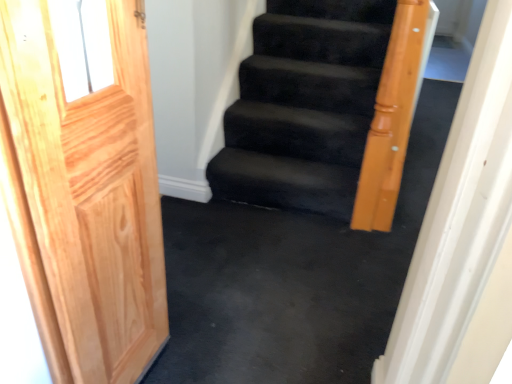
Image resolution: width=512 pixels, height=384 pixels. Find the location of `natural wood door at left`. natural wood door at left is located at coordinates (85, 198).

What is the approximate width of natural wood door at left?

natural wood door at left is 4.57 inches in width.

Measure the distance between point (38, 291) and camera.

Point (38, 291) is 36.61 inches away from camera.

What do you see at coordinates (85, 198) in the screenshot? I see `natural wood door at left` at bounding box center [85, 198].

The width and height of the screenshot is (512, 384). I want to click on natural wood door at left, so click(85, 198).